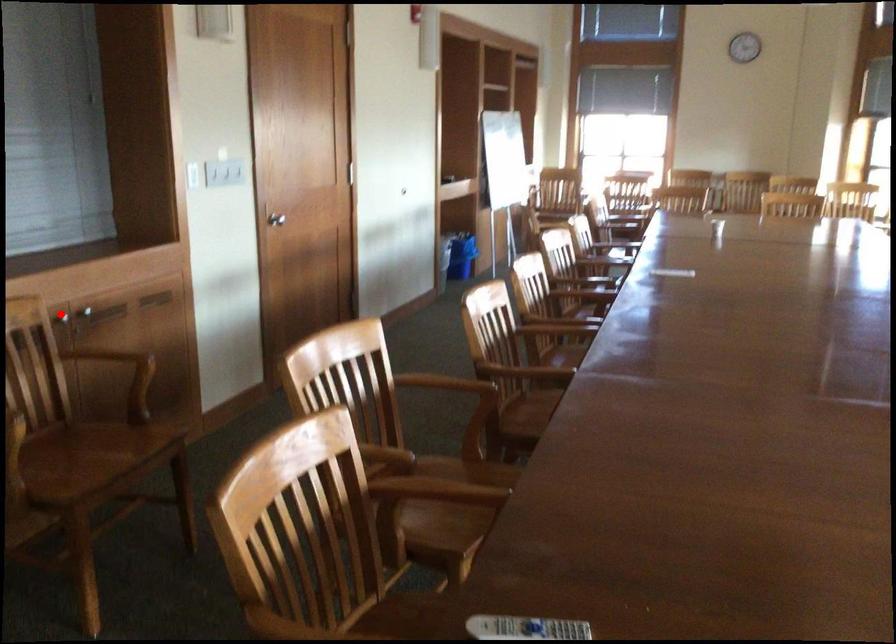
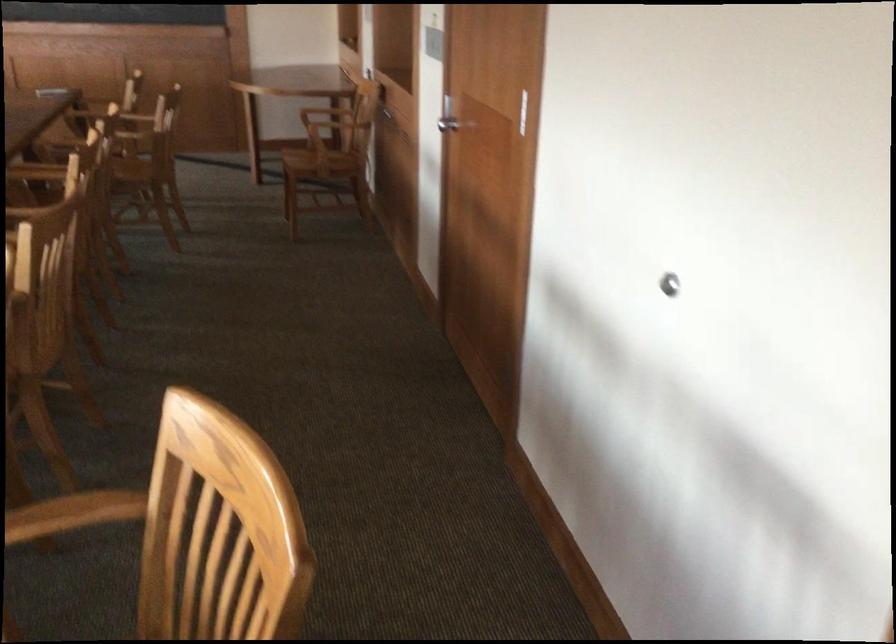
Question: I am providing you with two images of the same scene from different viewpoints. A red point is marked on the first image. Can you still see the location of the red point in image 2?

Choices:
 (A) Yes
 (B) No

Answer: (B)